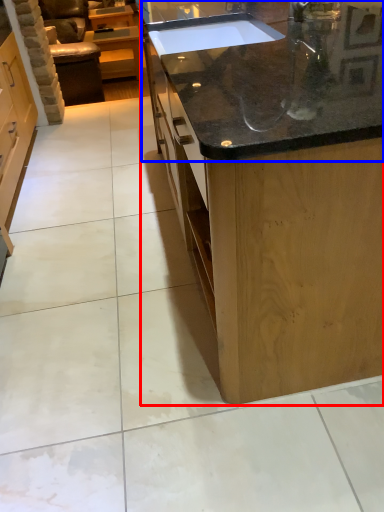
Question: Which object appears farthest to the camera in this image, countertop (highlighted by a red box) or countertop (highlighted by a blue box)?

Choices:
 (A) countertop
 (B) countertop

Answer: (B)